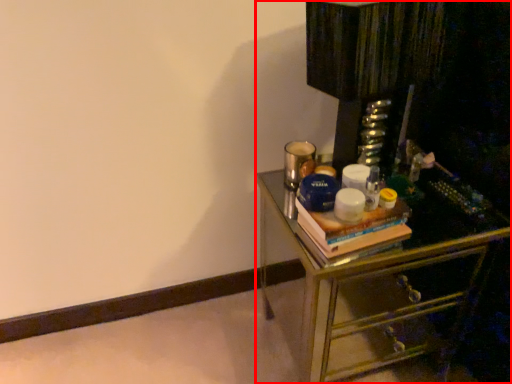
Question: From the image, what is the correct spatial relationship of chest of drawers (annotated by the red box) in relation to book?

Choices:
 (A) right
 (B) left

Answer: (A)